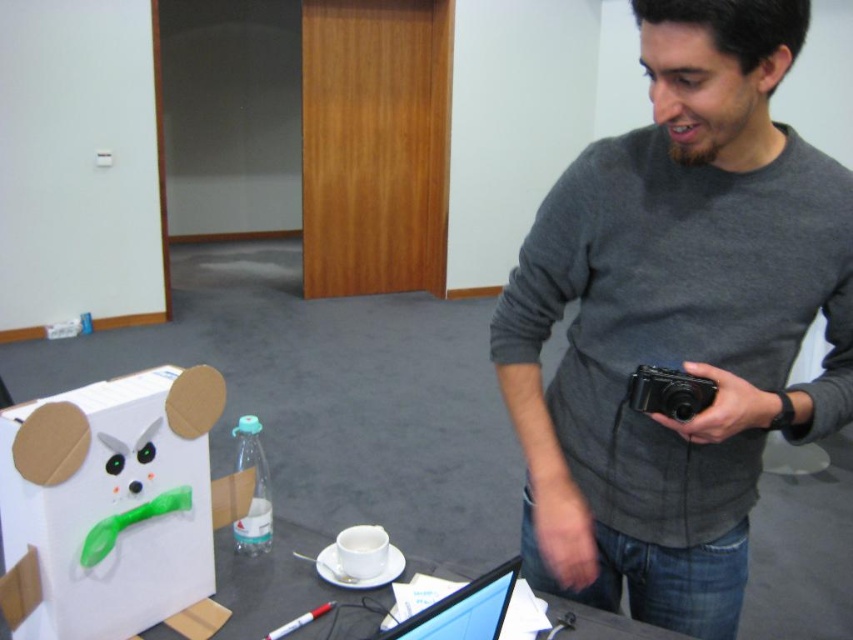
You are standing in the office scene. There is a point at coordinates point (67, 506). Can you reach that point without moving your feet?

The distance of point (67, 506) from viewer is 1.00 meters, so yes, you can reach that point without moving your feet as it is within arm reach.

Consider the image. You are organizing items on a table and need to place a new item between the white cardboard box at lower left and the black glossy laptop at center. Based on their positions, where should you place the new item?

The white cardboard box at lower left is located above the black glossy laptop at center, so you should place the new item between them by positioning it below the white cardboard box at lower left and above the black glossy laptop at center.

You are organizing items on a table and need to place a new item between the white cardboard box at lower left and the black glossy laptop at center. Given that the new item is 10 inches wide, will there be enough space between them?

The white cardboard box at lower left is 21.19 inches from the black glossy laptop at center. Since the new item is 10 inches wide, there is sufficient space between them to place the item.